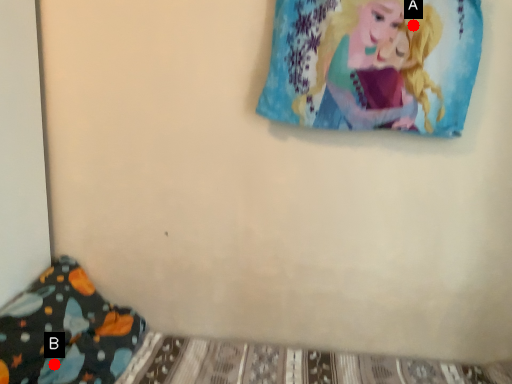
Question: Two points are circled on the image, labeled by A and B beside each circle. Which of the following is the closest to the observer?

Choices:
 (A) A is closer
 (B) B is closer

Answer: (B)